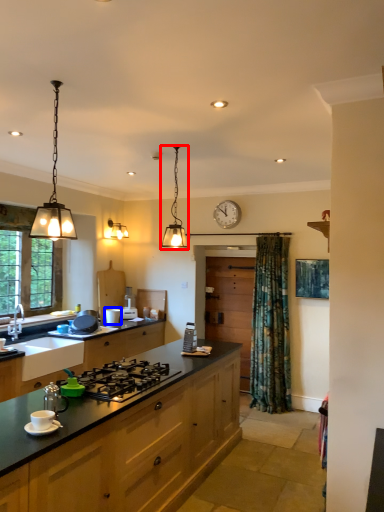
Question: Among these objects, which one is farthest to the camera, light fixture (highlighted by a red box) or appliance (highlighted by a blue box)?

Choices:
 (A) light fixture
 (B) appliance

Answer: (B)